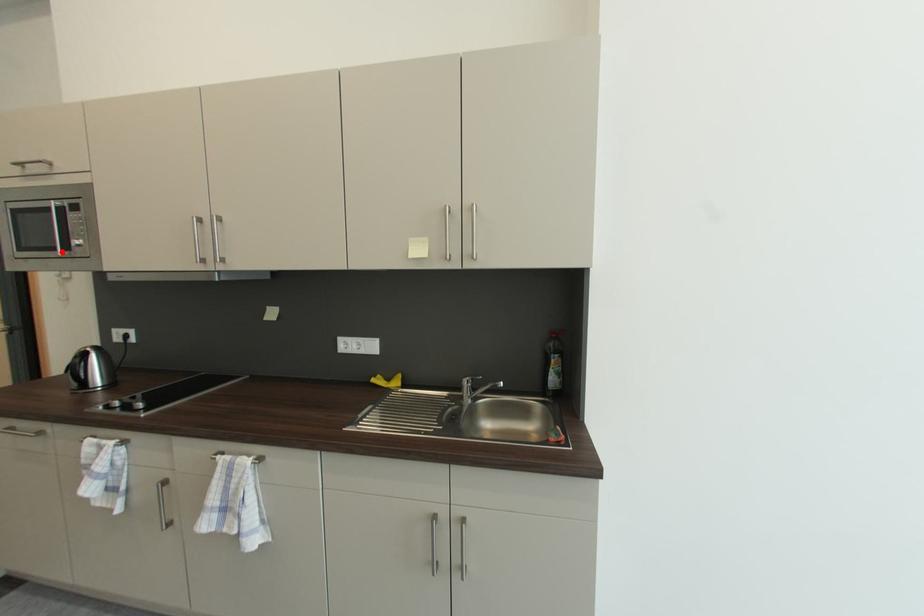
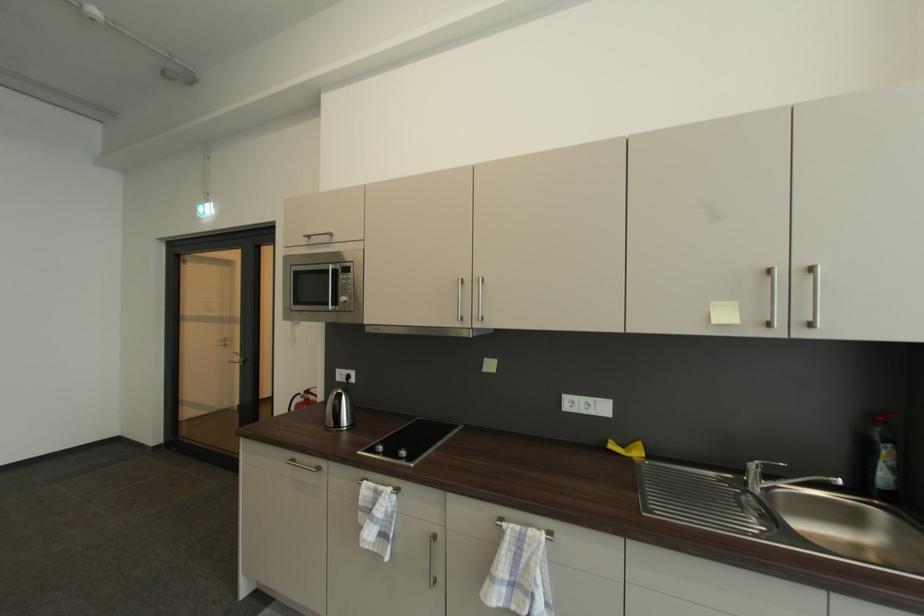
Question: A red point is marked in image1. In image2, is the corresponding 3D point closer to the camera or farther? Reply with the corresponding letter.

Choices:
 (A) The corresponding 3D point is closer.
 (B) The corresponding 3D point is farther.

Answer: (A)